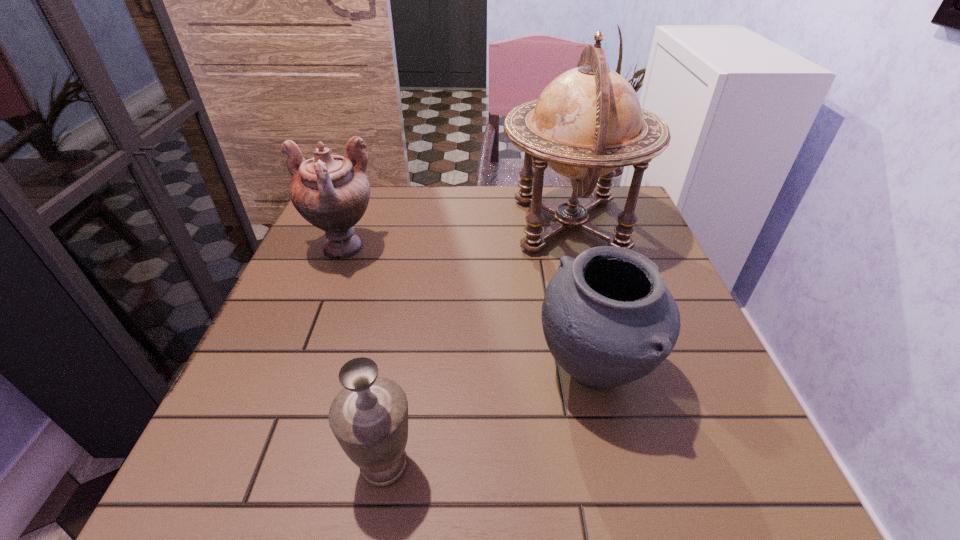
At what (x,y) coordinates should I click in order to perform the action: click on vacant region between the leftmost object and the second object from left to right. Please return your answer as a coordinate pair (x, y). The image size is (960, 540). Looking at the image, I should click on (363, 356).

The image size is (960, 540). Find the location of `vacant area that lies between the second farthest urn and the farthest urn`. vacant area that lies between the second farthest urn and the farthest urn is located at coordinates (468, 309).

Identify the location of object that ranks as the closest to the tallest object. The width and height of the screenshot is (960, 540). (608, 318).

Identify which object is the third nearest to the farthest urn. Please provide its 2D coordinates. Your answer should be formatted as a tuple, i.e. [(x, y)], where the tuple contains the x and y coordinates of a point satisfying the conditions above.

[(369, 417)]

Locate which urn is the closest to the third object from right to left. Please provide its 2D coordinates. Your answer should be formatted as a tuple, i.e. [(x, y)], where the tuple contains the x and y coordinates of a point satisfying the conditions above.

[(608, 318)]

Where is `the second closest urn to the globe`? the second closest urn to the globe is located at coordinates (332, 192).

Where is `vacant region that satisfies the following two spatial constraints: 1. on the front-facing side of the globe; 2. on the front side of the second nearest object`? The width and height of the screenshot is (960, 540). vacant region that satisfies the following two spatial constraints: 1. on the front-facing side of the globe; 2. on the front side of the second nearest object is located at coordinates click(x=610, y=372).

Where is `free spot that satisfies the following two spatial constraints: 1. on the front side of the third object from right to left; 2. on the left side of the leftmost urn`? This screenshot has width=960, height=540. free spot that satisfies the following two spatial constraints: 1. on the front side of the third object from right to left; 2. on the left side of the leftmost urn is located at coordinates [257, 464].